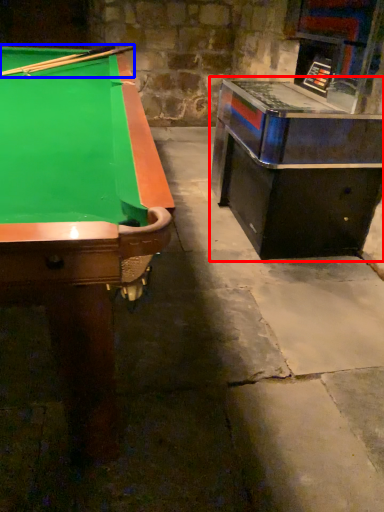
Question: Which object is further to the camera taking this photo, table (highlighted by a red box) or cue (highlighted by a blue box)?

Choices:
 (A) table
 (B) cue

Answer: (B)